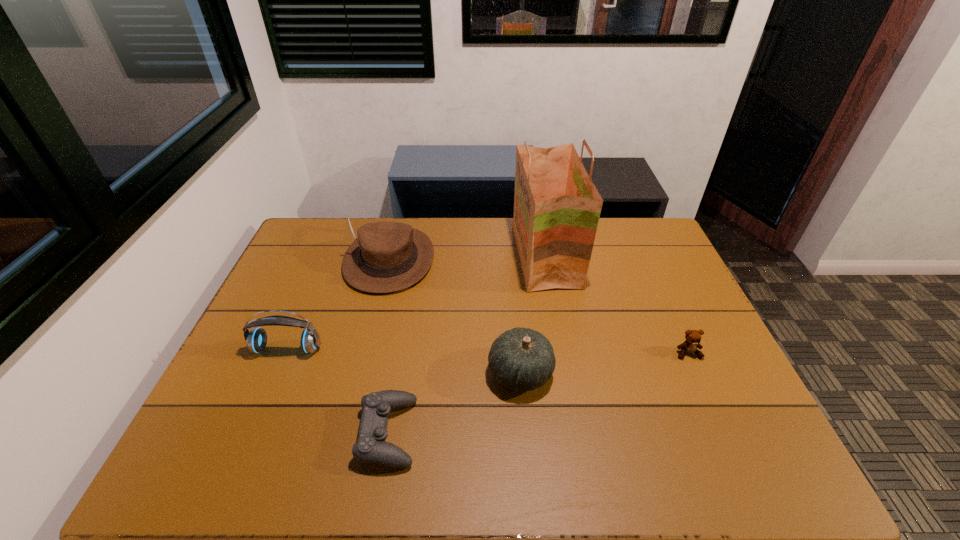
Locate an element on the screen. The width and height of the screenshot is (960, 540). vacant position located 0.210m on the ear cups of the headset is located at coordinates (252, 431).

The width and height of the screenshot is (960, 540). In order to click on vacant position located on the front-facing side of the teddy bear in this screenshot , I will do `click(714, 410)`.

Identify the location of free space located 0.050m on the back of the control. This screenshot has height=540, width=960. (396, 381).

You are a GUI agent. You are given a task and a screenshot of the screen. Output one action in this format:
    pyautogui.click(x=<x>, y=<y>)
    Task: Click on the grocery bag positioned at the far edge
    This screenshot has height=540, width=960.
    Given the screenshot: What is the action you would take?
    tap(557, 207)

The width and height of the screenshot is (960, 540). What are the coordinates of `fedora that is at the far edge` in the screenshot? It's located at click(x=386, y=257).

I want to click on object that is at the near edge, so click(x=371, y=447).

Find the location of a particular element. The width and height of the screenshot is (960, 540). object positioned at the left edge is located at coordinates (256, 339).

Image resolution: width=960 pixels, height=540 pixels. Identify the location of object that is at the right edge. (693, 337).

Identify the location of vacant space at the far edge of the desktop. The image size is (960, 540). (458, 222).

Where is `vacant space at the left edge of the desktop`? The image size is (960, 540). vacant space at the left edge of the desktop is located at coordinates (313, 278).